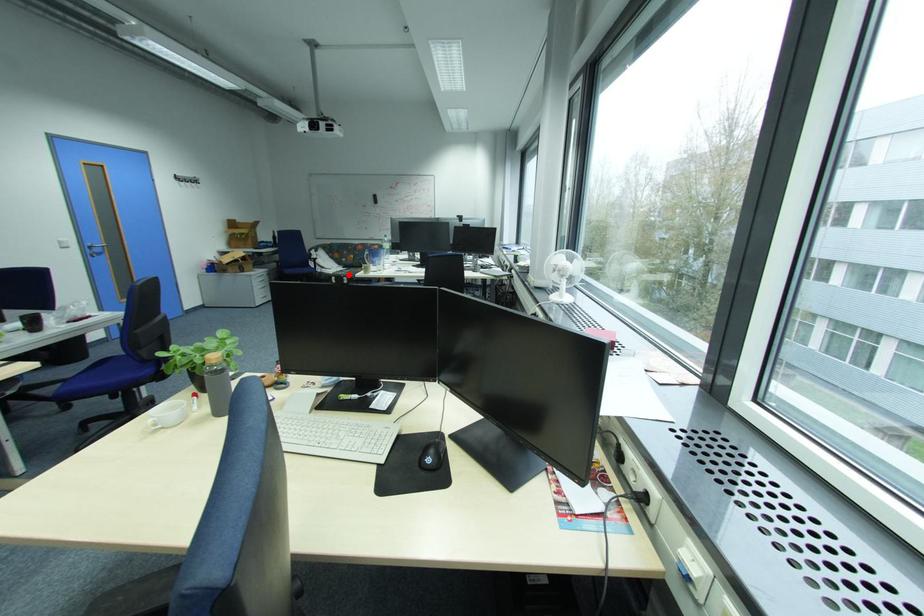
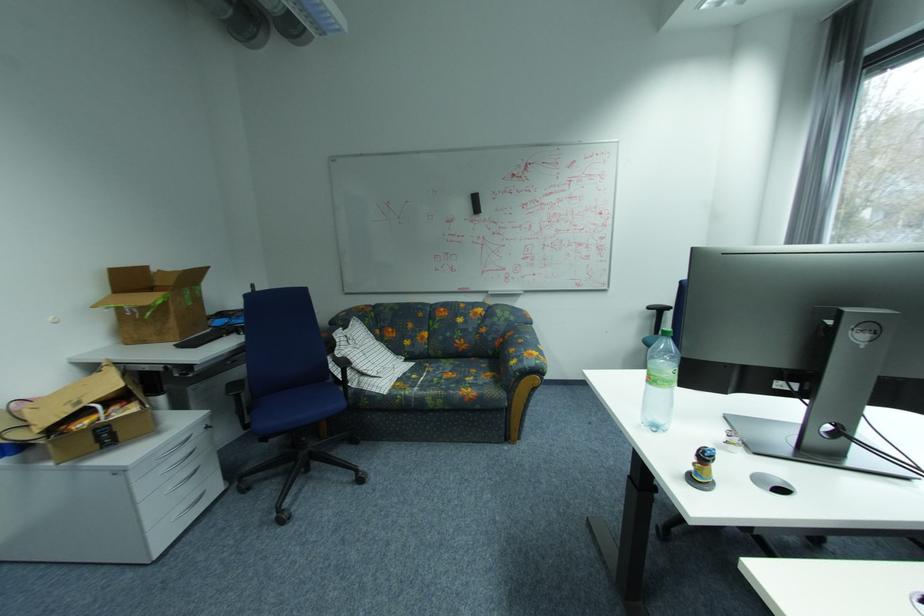
Question: I am providing you with two images of the same scene from different viewpoints. A red point is shown in image1. For the corresponding object point in image2, is it positioned nearer or farther from the camera?

Choices:
 (A) Nearer
 (B) Farther

Answer: (A)